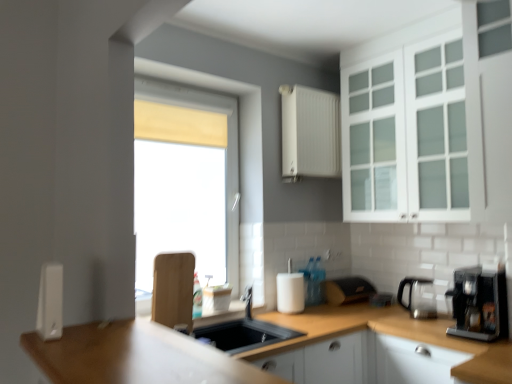
Question: In terms of width, does black plastic coffee machine at right, which ranks as the 1th coffee machine in front-to-back order, look wider or thinner when compared to white matte cabinet at upper center, marked as the 1th cabinetry in a top-to-bottom arrangement?

Choices:
 (A) thin
 (B) wide

Answer: (B)

Question: Is point (493, 337) closer or farther from the camera than point (337, 127)?

Choices:
 (A) farther
 (B) closer

Answer: (B)

Question: Which object is the closest to the satin silver coffee machine at right, acting as the 2th coffee machine starting from the front?

Choices:
 (A) white glass cabinet at upper right, the second cabinetry positioned from the bottom
 (B) matte yellow curtain at center
 (C) black plastic coffee machine at right, which ranks as the 1th coffee machine in front-to-back order
 (D) white matte cabinet at lower right, the 3th cabinetry from the top
 (E) white plastic soap dispenser at left, which is the second appliance in bottom-to-top order

Answer: (C)

Question: Based on their relative distances, which object is farther from the satin silver coffee machine at right, acting as the 2th coffee machine starting from the front?

Choices:
 (A) black plastic coffee machine at right, placed as the 2th coffee machine when sorted from back to front
 (B) matte black toaster at center, the first appliance ordered from the bottom
 (C) white glass cabinet at upper right, which appears as the 2th cabinetry when viewed from the top
 (D) white matte cabinet at upper center, which is counted as the third cabinetry, starting from the bottom
 (E) white matte cabinet at lower right, positioned as the 1th cabinetry in bottom-to-top order

Answer: (D)